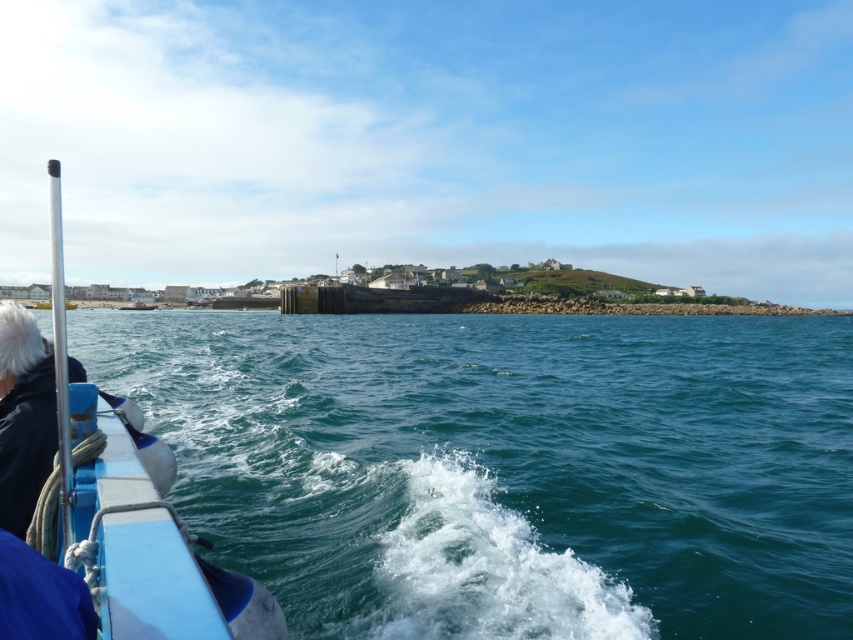
You are navigating a small boat and need to avoid hitting a rocky shoreline. According to the image, where is the teal water at lower left located in relation to your position?

The teal water at lower left is located at point (506, 467), so you should steer towards that area to avoid the rocky shoreline.

You are standing on the boat and want to reach a specific point in the water marked at coordinates point (589, 435). If your boat has a safety zone of 20 meters, will you be able to safely approach that point without entering dangerous waters?

The point (589, 435) is 17.45 meters from the viewer, which is within the boat safety zone of 20 meters. Therefore, you can safely approach the point without entering dangerous waters.

You are on a boat and want to know if the teal water at lower left has more area coverage compared to the blue rubber boat at left. Based on the scene description, what can you conclude?

The teal water at lower left occupies less space than the blue rubber boat at left, so the blue rubber boat at left has more area coverage.